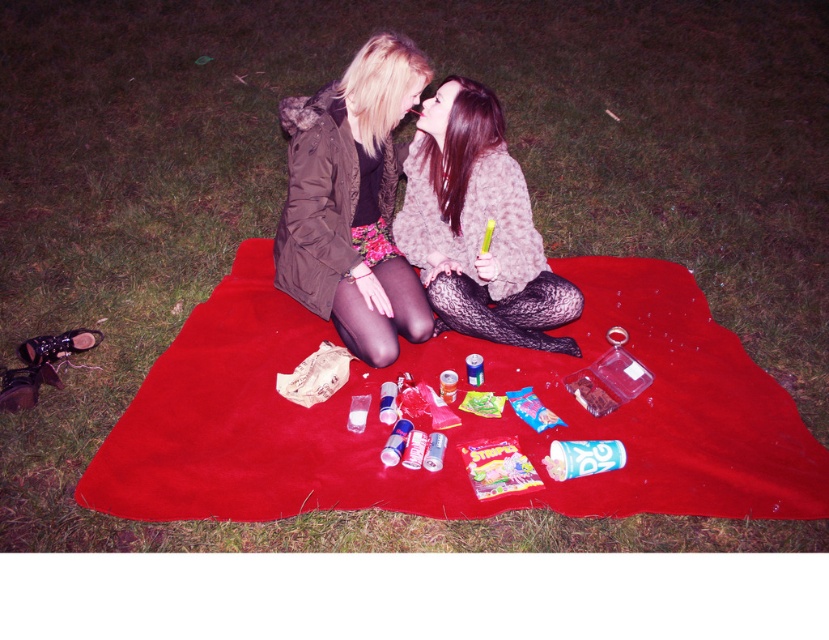
You are standing at the origin point of the image coordinate system. You want to place a new item exactly 0.1 units to the right of the red suede blanket at center. What are the coordinates of the new item?

The red suede blanket at center is located at point (456, 412). Adding 0.1 to the x coordinate gives 0.745, so the new item would be at coordinates (456, 476).

You are an observer looking at the scene of two people sitting on a picnic blanket. You notice the matte brown jacket at center and the shiny gray sweater at center. Which clothing item appears larger in height?

The matte brown jacket at center is taller than the shiny gray sweater at center, so the matte brown jacket at center appears larger in height.

You are a photographer trying to capture a candid shot of the two people on the red suede blanket at center and the matte brown jacket at center. To avoid disrupting them, you need to know if the blanket is visible beneath the jacket. Can you confirm this?

The red suede blanket at center is positioned under matte brown jacket at center, so the blanket is not visible beneath the jacket.